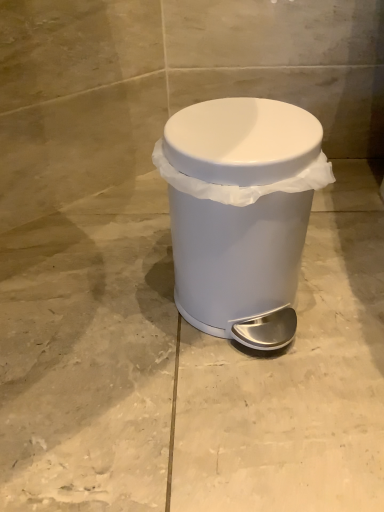
The image size is (384, 512). Find the location of `white glossy trash can at center`. white glossy trash can at center is located at coordinates (240, 212).

This screenshot has width=384, height=512. What do you see at coordinates (240, 212) in the screenshot? I see `white glossy trash can at center` at bounding box center [240, 212].

Image resolution: width=384 pixels, height=512 pixels. Find the location of `white glossy trash can at center`. white glossy trash can at center is located at coordinates (240, 212).